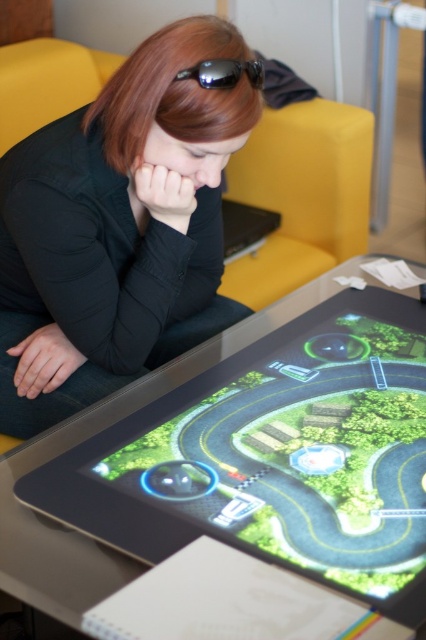
You are a photographer trying to capture a closeup of the black reflective goggles at upper center without including the black matte shirt at center in the shot. Is this possible given their positions?

The black matte shirt at center is further to the viewer than black reflective goggles at upper center, so the goggles are behind the shirt. This means the shirt would block the view of the goggles, making it impossible to capture a closeup of the black reflective goggles at upper center without including the black matte shirt at center in the shot.

Looking at this image, you are a visitor at a tech exhibition and see the green glossy tablet at center and the black reflective goggles at upper center on the table. Which object takes up more space on the table?

The green glossy tablet at center is larger in size than the black reflective goggles at upper center, so it takes up more space on the table.